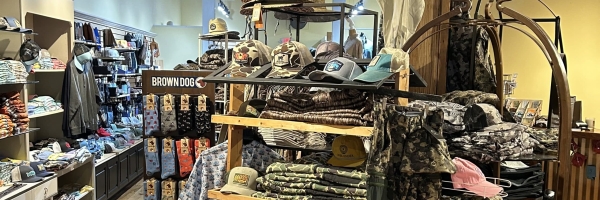
This screenshot has height=200, width=600. In order to click on cabinet in this screenshot , I will do `click(46, 189)`, `click(130, 169)`.